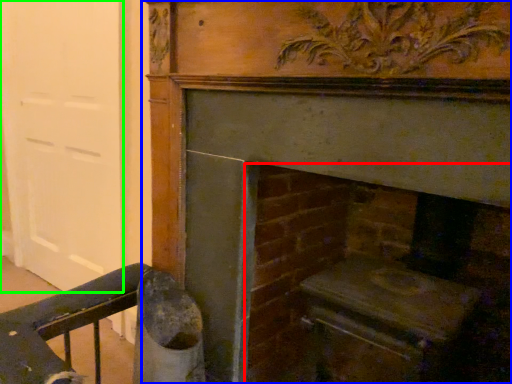
Question: Estimate the real-world distances between objects in this image. Which object is farther from fireplace (highlighted by a red box), fireplace (highlighted by a blue box) or door (highlighted by a green box)?

Choices:
 (A) fireplace
 (B) door

Answer: (B)